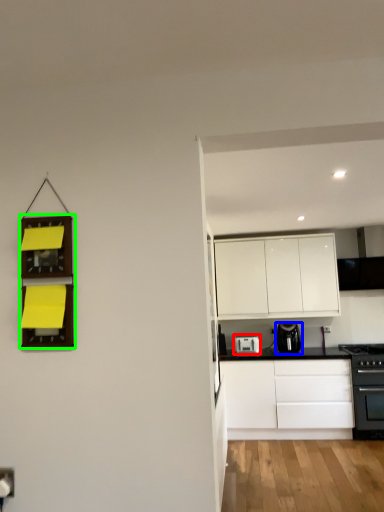
Question: Which object is the farthest from kitchen appliance (highlighted by a red box)? Choose among these: kitchen appliance (highlighted by a blue box) or shelf (highlighted by a green box).

Choices:
 (A) kitchen appliance
 (B) shelf

Answer: (B)